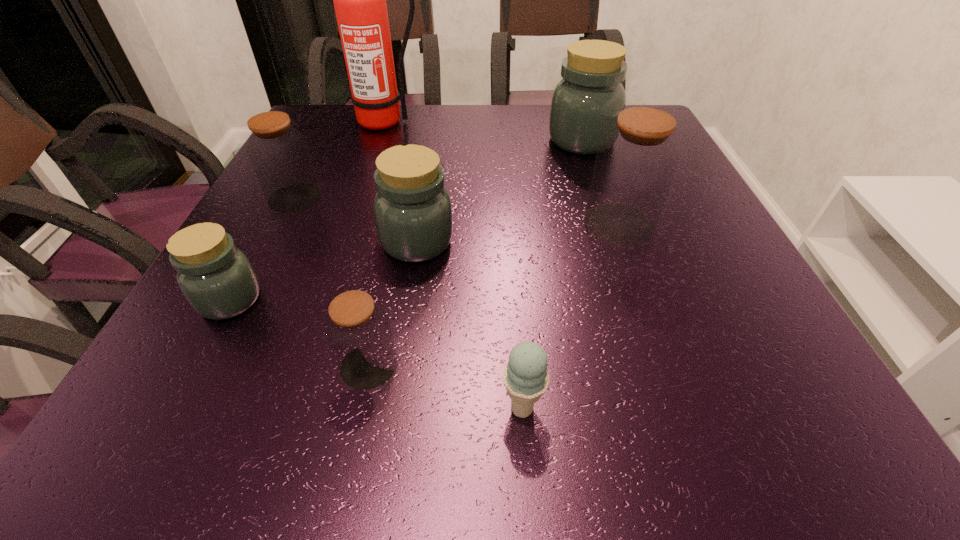
Locate an element on the screen. vacant space at the near edge of the desktop is located at coordinates (329, 397).

At what (x,y) coordinates should I click in order to perform the action: click on vacant space at the left edge of the desktop. Please return your answer as a coordinate pair (x, y). The image size is (960, 540). Looking at the image, I should click on pyautogui.click(x=305, y=224).

Identify the location of vacant region at the right edge. The width and height of the screenshot is (960, 540). (677, 309).

This screenshot has width=960, height=540. I want to click on vacant region at the far left corner, so click(x=323, y=105).

The image size is (960, 540). Find the location of `vacant area at the near left corner of the desktop`. vacant area at the near left corner of the desktop is located at coordinates (219, 390).

Locate an element on the screen. This screenshot has width=960, height=540. free space between the second green jar from right to left and the biggest brown jar is located at coordinates (517, 232).

At what (x,y) coordinates should I click in order to perform the action: click on vacant space in between the rightmost brown jar and the third object from right to left. Please return your answer as a coordinate pair (x, y). The width and height of the screenshot is (960, 540). Looking at the image, I should click on (570, 316).

Where is `vacant space in between the third object from right to left and the second brown jar from right to left`? This screenshot has height=540, width=960. vacant space in between the third object from right to left and the second brown jar from right to left is located at coordinates (445, 387).

This screenshot has height=540, width=960. Identify the location of empty space between the third nearest object and the smallest brown jar. (300, 333).

Locate an element on the screen. The height and width of the screenshot is (540, 960). vacant area between the tallest object and the biggest brown jar is located at coordinates (502, 173).